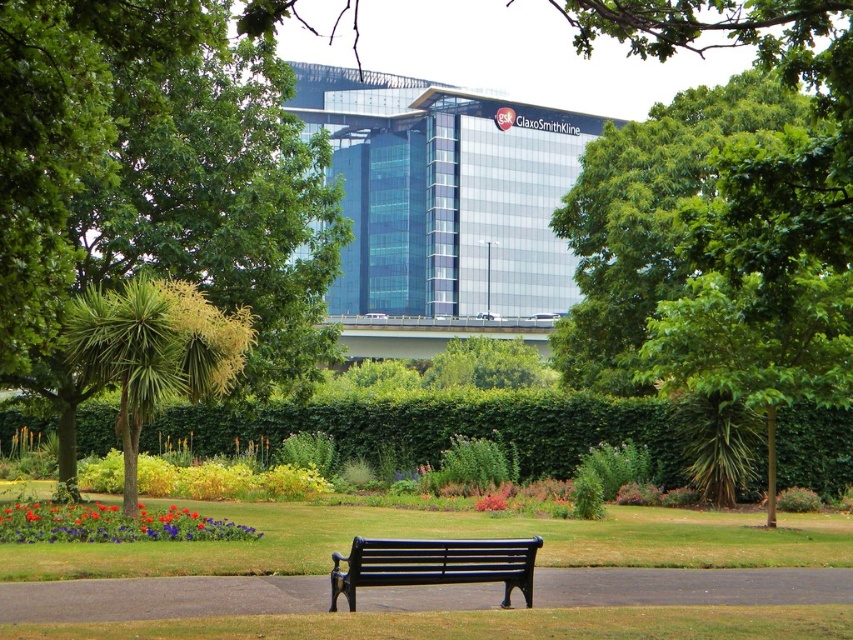
Question: Is green leafy tree at center above black metal bench at center?

Choices:
 (A) no
 (B) yes

Answer: (B)

Question: Estimate the real-world distances between objects in this image. Which object is farther from the black metal bench at center?

Choices:
 (A) green leafy tree at center
 (B) green leafy tree at left

Answer: (A)

Question: Is green leafy tree at center smaller than black metal bench at center?

Choices:
 (A) yes
 (B) no

Answer: (B)

Question: Does green leafy tree at left have a smaller size compared to black metal bench at center?

Choices:
 (A) yes
 (B) no

Answer: (B)

Question: Which of the following is the closest to the observer?

Choices:
 (A) green leafy tree at center
 (B) green leafy tree at left
 (C) black metal bench at center

Answer: (A)

Question: Which point is closer to the camera taking this photo?

Choices:
 (A) (405, 557)
 (B) (161, 339)

Answer: (A)